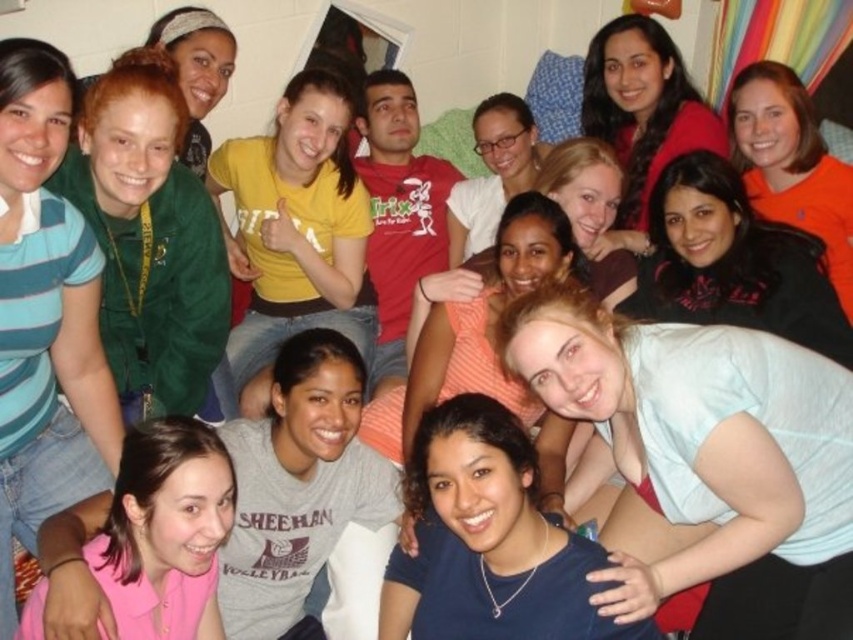
Question: Which of the following is the farthest from the observer?

Choices:
 (A) light blue fabric at center
 (B) green fabric jacket at upper left
 (C) matte black hoodie at upper right

Answer: (C)

Question: Among these points, which one is farthest from the camera?

Choices:
 (A) [337, 92]
 (B) [564, 312]
 (C) [543, 556]

Answer: (A)

Question: Which point is closer to the camera?

Choices:
 (A) black matte jacket at upper right
 (B) green fabric jacket at upper left

Answer: (B)

Question: Is matte yellow t-shirt at center smaller than matte black hoodie at upper right?

Choices:
 (A) no
 (B) yes

Answer: (A)

Question: Is blue matte shirt at center further to the viewer compared to matte orange shirt at center?

Choices:
 (A) yes
 (B) no

Answer: (B)

Question: Observing the image, what is the correct spatial positioning of orange matte shirt at upper right in reference to matte orange shirt at center?

Choices:
 (A) right
 (B) left

Answer: (A)